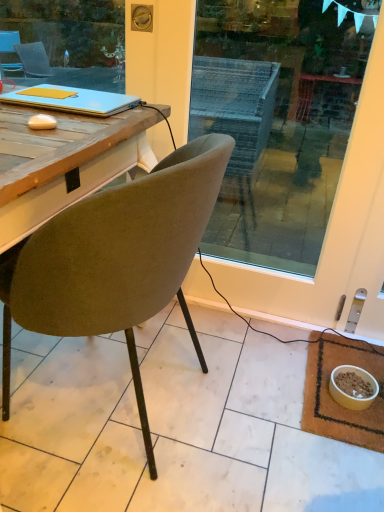
At what (x,y) coordinates should I click in order to perform the action: click on yellow matte bowl at lower right. Please return your answer as a coordinate pair (x, y). Looking at the image, I should click on (353, 389).

This screenshot has height=512, width=384. I want to click on brown woven mat at lower right, so click(335, 401).

The width and height of the screenshot is (384, 512). I want to click on yellow matte bowl at lower right, so click(x=353, y=389).

Locate an element on the screen. The image size is (384, 512). mat that appears on the right of velvet olive chair at center is located at coordinates click(x=335, y=401).

Who is shorter, brown woven mat at lower right or velvet olive chair at center?

brown woven mat at lower right is shorter.

From the image's perspective, is brown woven mat at lower right on top of velvet olive chair at center?

Actually, brown woven mat at lower right appears below velvet olive chair at center in the image.

Can you tell me how much brown woven mat at lower right and velvet olive chair at center differ in facing direction?

They differ by 0.000643 degrees in their facing directions.

Between matte blue laptop at upper left and yellow matte bowl at lower right, which one has smaller size?

yellow matte bowl at lower right.

What's the angular difference between matte blue laptop at upper left and yellow matte bowl at lower right's facing directions?

The angle between the facing direction of matte blue laptop at upper left and the facing direction of yellow matte bowl at lower right is 0.000835 degrees.

Based on the photo, between matte blue laptop at upper left and yellow matte bowl at lower right, which one appears on the right side from the viewer's perspective?

yellow matte bowl at lower right.

Which object is more forward, matte blue laptop at upper left or yellow matte bowl at lower right?

matte blue laptop at upper left is more forward.

Between brown woven mat at lower right and yellow matte bowl at lower right, which one has larger width?

brown woven mat at lower right is wider.

Which is in front, brown woven mat at lower right or yellow matte bowl at lower right?

brown woven mat at lower right is more forward.

Does brown woven mat at lower right appear on the right side of yellow matte bowl at lower right?

Yes.

Consider the image. Which point is more forward, [321,406] or [330,392]?

The point [321,406] is in front.

Is yellow matte bowl at lower right behind brown woven mat at lower right?

Yes, yellow matte bowl at lower right is further from the camera.

Considering the relative positions of yellow matte bowl at lower right and brown woven mat at lower right in the image provided, is yellow matte bowl at lower right to the left of brown woven mat at lower right from the viewer's perspective?

Yes, yellow matte bowl at lower right is to the left of brown woven mat at lower right.

Are yellow matte bowl at lower right and brown woven mat at lower right making contact?

Yes, yellow matte bowl at lower right is right next to brown woven mat at lower right and making contact.

Considering the sizes of yellow matte bowl at lower right and brown woven mat at lower right in the image, is yellow matte bowl at lower right bigger or smaller than brown woven mat at lower right?

Considering their sizes, yellow matte bowl at lower right takes up less space than brown woven mat at lower right.

Is matte blue laptop at upper left bigger than brown woven mat at lower right?

Incorrect, matte blue laptop at upper left is not larger than brown woven mat at lower right.

From a real-world perspective, is matte blue laptop at upper left over brown woven mat at lower right?

Yes, from a real-world perspective, matte blue laptop at upper left is on top of brown woven mat at lower right.

Which object is positioned more to the right, matte blue laptop at upper left or brown woven mat at lower right?

brown woven mat at lower right.

Could brown woven mat at lower right be considered to be inside matte blue laptop at upper left?

Definitely not — brown woven mat at lower right is not inside matte blue laptop at upper left.

Is velvet olive chair at center not within matte blue laptop at upper left?

Yes, velvet olive chair at center is located beyond the bounds of matte blue laptop at upper left.

From the image's perspective, who appears lower, velvet olive chair at center or matte blue laptop at upper left?

From the image's view, velvet olive chair at center is below.

Is velvet olive chair at center oriented away from matte blue laptop at upper left?

No, velvet olive chair at center's orientation is not away from matte blue laptop at upper left.

Is point (127, 281) positioned after point (103, 104)?

No, it is in front of (103, 104).

Which object is thinner, yellow matte bowl at lower right or matte blue laptop at upper left?

With smaller width is yellow matte bowl at lower right.

Is yellow matte bowl at lower right further to camera compared to matte blue laptop at upper left?

Yes.

Can you confirm if yellow matte bowl at lower right is positioned to the left of matte blue laptop at upper left?

Incorrect, yellow matte bowl at lower right is not on the left side of matte blue laptop at upper left.

Is point (375, 382) closer or farther from the camera than point (62, 97)?

Point (375, 382) appears to be farther away from the viewer than point (62, 97).

You are a GUI agent. You are given a task and a screenshot of the screen. Output one action in this format:
    pyautogui.click(x=<x>, y=<y>)
    Task: Click on the mat lying below the velvet olive chair at center (from the image's perspective)
    The image size is (384, 512).
    Given the screenshot: What is the action you would take?
    pyautogui.click(x=335, y=401)

Where is `bowl on the right of matte blue laptop at upper left`? The image size is (384, 512). bowl on the right of matte blue laptop at upper left is located at coordinates (353, 389).

When comparing their distances from velvet olive chair at center, does brown woven mat at lower right or yellow matte bowl at lower right seem further?

Among the two, yellow matte bowl at lower right is located further to velvet olive chair at center.

From the picture: When comparing their distances from matte blue laptop at upper left, does brown woven mat at lower right or velvet olive chair at center seem closer?

Based on the image, velvet olive chair at center appears to be nearer to matte blue laptop at upper left.

Based on the photo, from the image, which object appears to be farther from matte blue laptop at upper left, brown woven mat at lower right or yellow matte bowl at lower right?

yellow matte bowl at lower right is further to matte blue laptop at upper left.

Considering their positions, is brown woven mat at lower right positioned closer to yellow matte bowl at lower right than matte blue laptop at upper left?

The object closer to yellow matte bowl at lower right is brown woven mat at lower right.

When comparing their distances from yellow matte bowl at lower right, does brown woven mat at lower right or velvet olive chair at center seem closer?

Based on the image, brown woven mat at lower right appears to be nearer to yellow matte bowl at lower right.

Considering their positions, is matte blue laptop at upper left positioned further to brown woven mat at lower right than yellow matte bowl at lower right?

Based on the image, matte blue laptop at upper left appears to be further to brown woven mat at lower right.

Based on their spatial positions, is yellow matte bowl at lower right or brown woven mat at lower right further from velvet olive chair at center?

Among the two, yellow matte bowl at lower right is located further to velvet olive chair at center.

Considering their positions, is velvet olive chair at center positioned closer to matte blue laptop at upper left than yellow matte bowl at lower right?

velvet olive chair at center.

Locate an element on the screen. chair located between matte blue laptop at upper left and brown woven mat at lower right in the left-right direction is located at coordinates (121, 256).

This screenshot has height=512, width=384. I want to click on bowl located between velvet olive chair at center and brown woven mat at lower right in the left-right direction, so click(x=353, y=389).

You are a GUI agent. You are given a task and a screenshot of the screen. Output one action in this format:
    pyautogui.click(x=<x>, y=<y>)
    Task: Click on the bowl between matte blue laptop at upper left and brown woven mat at lower right in the vertical direction
    This screenshot has height=512, width=384.
    Given the screenshot: What is the action you would take?
    pyautogui.click(x=353, y=389)

At what (x,y) coordinates should I click in order to perform the action: click on chair situated between matte blue laptop at upper left and yellow matte bowl at lower right from left to right. Please return your answer as a coordinate pair (x, y). This screenshot has width=384, height=512. Looking at the image, I should click on (121, 256).